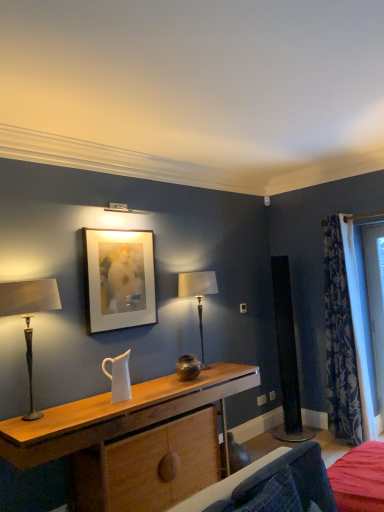
Question: Is matte bronze table lamp at center, marked as the 1th table lamp in a back-to-front arrangement, turned away from matte white picture frame at upper center?

Choices:
 (A) no
 (B) yes

Answer: (A)

Question: Is matte bronze table lamp at center, which ranks as the second table lamp in left-to-right order, smaller than matte white picture frame at upper center?

Choices:
 (A) yes
 (B) no

Answer: (B)

Question: From a real-world perspective, does matte bronze table lamp at center, which ranks as the second table lamp in left-to-right order, sit lower than matte white picture frame at upper center?

Choices:
 (A) yes
 (B) no

Answer: (A)

Question: Is the depth of matte bronze table lamp at center, the 1th table lamp positioned from the right, greater than that of matte white picture frame at upper center?

Choices:
 (A) yes
 (B) no

Answer: (A)

Question: From the image's perspective, is matte bronze table lamp at center, the 1th table lamp positioned from the right, on top of matte white picture frame at upper center?

Choices:
 (A) yes
 (B) no

Answer: (B)

Question: Relative to blue floral fabric curtain at right, is velvet blue armchair at lower right in front or behind?

Choices:
 (A) behind
 (B) front

Answer: (B)

Question: Is velvet blue armchair at lower right bigger or smaller than blue floral fabric curtain at right?

Choices:
 (A) big
 (B) small

Answer: (B)

Question: From the image's perspective, is velvet blue armchair at lower right located above or below blue floral fabric curtain at right?

Choices:
 (A) below
 (B) above

Answer: (A)

Question: Considering the positions of point (297, 446) and point (357, 378), is point (297, 446) closer or farther from the camera than point (357, 378)?

Choices:
 (A) closer
 (B) farther

Answer: (A)

Question: From a real-world perspective, is wooden desk at center above or below matte white picture frame at upper center?

Choices:
 (A) above
 (B) below

Answer: (B)

Question: Which is correct: wooden desk at center is inside matte white picture frame at upper center, or outside of it?

Choices:
 (A) inside
 (B) outside

Answer: (B)

Question: Considering the positions of wooden desk at center and matte white picture frame at upper center in the image, is wooden desk at center wider or thinner than matte white picture frame at upper center?

Choices:
 (A) thin
 (B) wide

Answer: (B)

Question: Is point (49, 411) closer or farther from the camera than point (94, 301)?

Choices:
 (A) farther
 (B) closer

Answer: (B)

Question: In terms of height, does velvet blue armchair at lower right look taller or shorter compared to matte bronze table lamp at center, the 1th table lamp positioned from the right?

Choices:
 (A) tall
 (B) short

Answer: (B)

Question: Is velvet blue armchair at lower right wider or thinner than matte bronze table lamp at center, which ranks as the 2th table lamp in front-to-back order?

Choices:
 (A) thin
 (B) wide

Answer: (B)